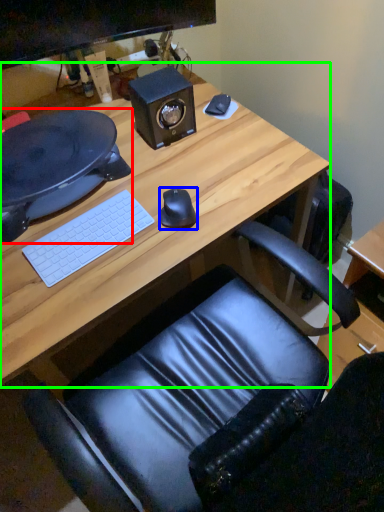
Question: Based on their relative distances, which object is farther from desktop (highlighted by a red box)? Choose from mouse (highlighted by a blue box) and desk (highlighted by a green box).

Choices:
 (A) mouse
 (B) desk

Answer: (A)